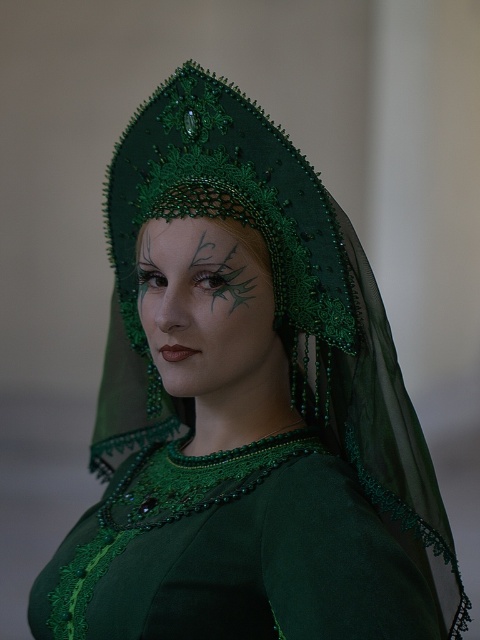
You are an artist trying to replicate the costume design. You need to place a green matte eyebrow at upper center exactly where it was in the original image. What coordinates should you use?

The green matte eyebrow at upper center should be placed at coordinates (202, 244).